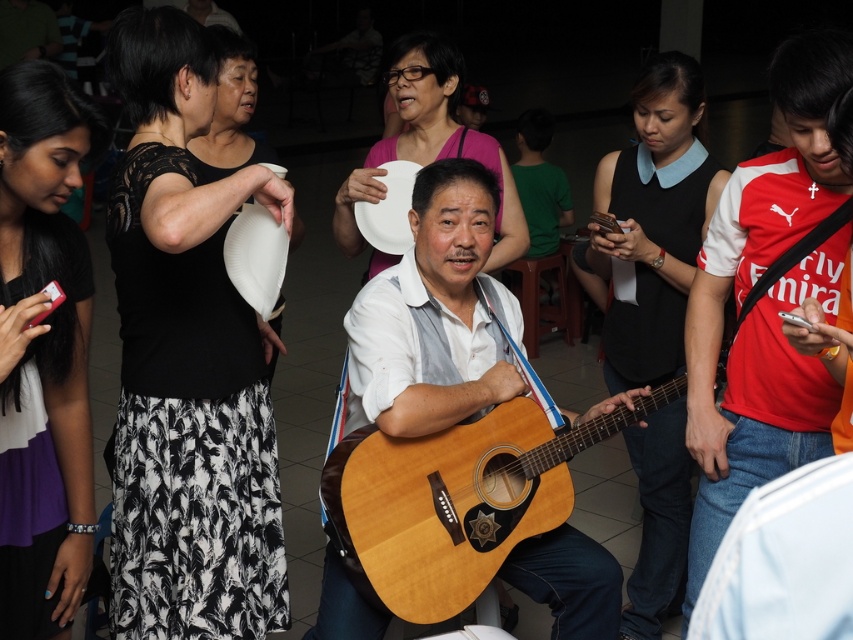
What is the color of the item located at the coordinates point (187, 358)?

The item located at point (187, 358) is a black lace top at upper left.

Based on the scene description, which object is larger in size between the black lace top at upper left and the red jersey at right?

The black lace top at upper left is larger in size than the red jersey at right.